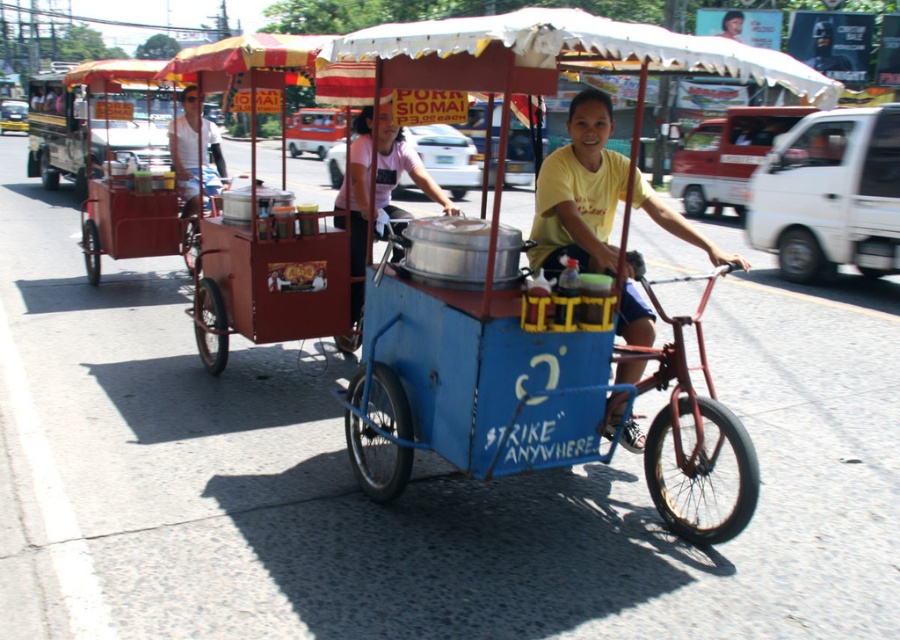
You are a customer standing in the street and see the matte red cart at left and the white matte shirt at upper left. Which object is located more to the left?

The matte red cart at left is more to the left.

You are a customer standing in front of the matte red cart at left and the white matte shirt at upper left. Which object is taller?

The matte red cart at left is much taller than the white matte shirt at upper left.

You are a customer looking at the metallic silver pot at center and the white matte shirt at upper left. Which object is taller?

The metallic silver pot at center is taller than the white matte shirt at upper left.